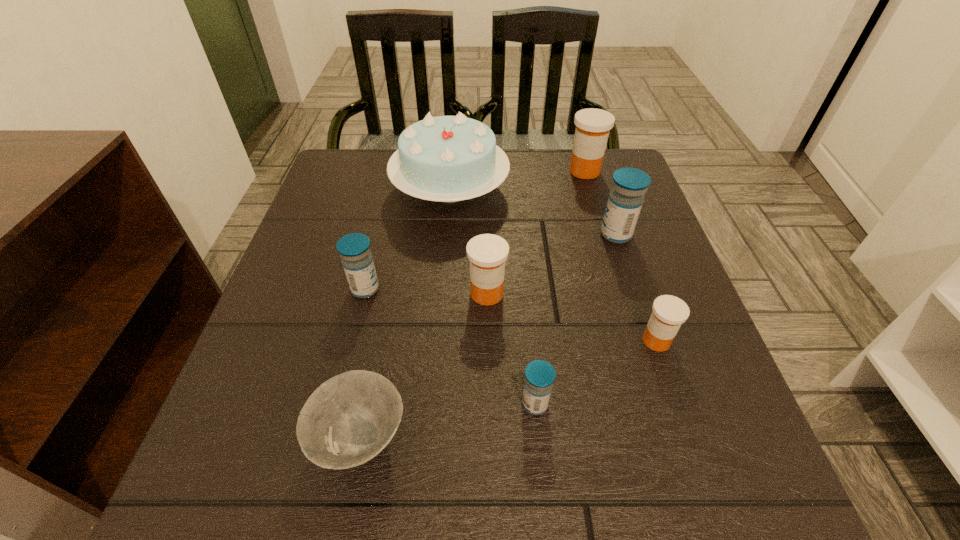
The width and height of the screenshot is (960, 540). Identify the location of medicine at the left edge. (354, 249).

Find the location of a particular element. This screenshot has width=960, height=540. bowl at the left edge is located at coordinates (347, 421).

Identify the location of object at the near left corner. This screenshot has width=960, height=540. (347, 421).

This screenshot has width=960, height=540. In order to click on object that is at the far right corner in this screenshot , I will do tap(593, 125).

In order to click on vacant area at the far edge in this screenshot , I will do `click(536, 172)`.

In the image, there is a desktop. Where is `vacant space at the near edge`? The width and height of the screenshot is (960, 540). vacant space at the near edge is located at coordinates (505, 492).

This screenshot has width=960, height=540. Identify the location of free space at the left edge. (301, 381).

Locate an element on the screen. vacant space at the right edge of the desktop is located at coordinates (615, 265).

This screenshot has height=540, width=960. In the image, there is a desktop. What are the coordinates of `free space at the far left corner` in the screenshot? It's located at (332, 176).

The width and height of the screenshot is (960, 540). I want to click on free space at the near right corner of the desktop, so click(669, 482).